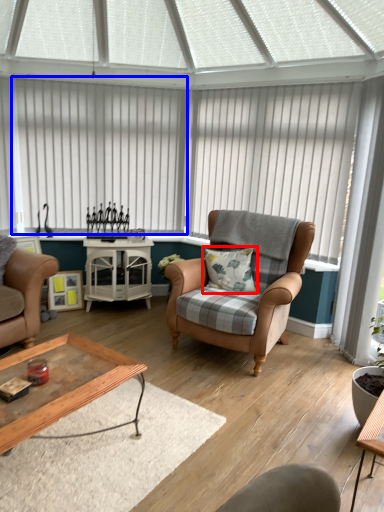
Question: Which object appears closest to the camera in this image, pillow (highlighted by a red box) or blind (highlighted by a blue box)?

Choices:
 (A) pillow
 (B) blind

Answer: (A)